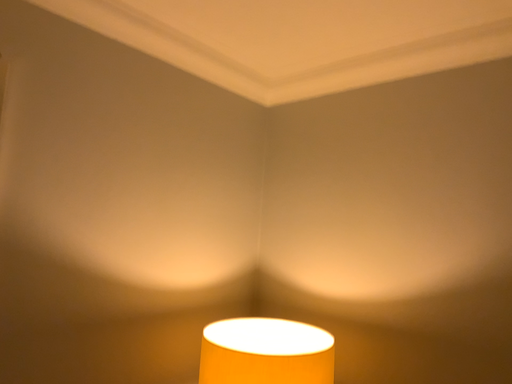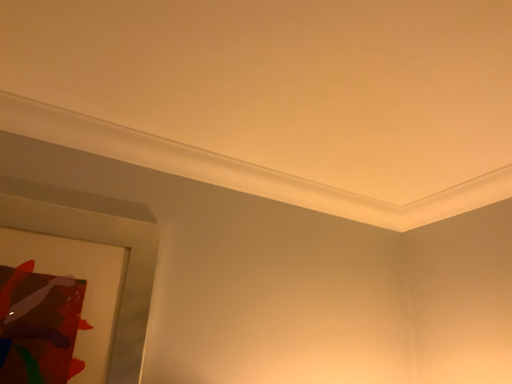
Question: Which way did the camera rotate in the video?

Choices:
 (A) rotated upward
 (B) rotated downward

Answer: (A)